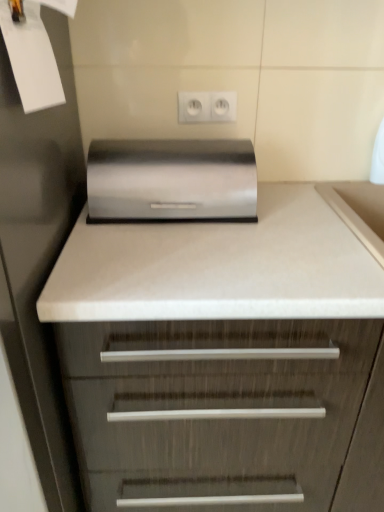
Question: Looking at their shapes, would you say white paper at upper left is wider or thinner than white plastic electric outlet at upper center?

Choices:
 (A) thin
 (B) wide

Answer: (B)

Question: Is white paper at upper left taller or shorter than white plastic electric outlet at upper center?

Choices:
 (A) tall
 (B) short

Answer: (A)

Question: Considering the real-world distances, which object is closest to the satin wood chest of drawers at center?

Choices:
 (A) white plastic electric outlet at upper center
 (B) white paper at upper left
 (C) satin metallic breadbox at center

Answer: (C)

Question: Which is farther from the white plastic electric outlet at upper center?

Choices:
 (A) satin wood chest of drawers at center
 (B) white paper at upper left
 (C) satin metallic breadbox at center

Answer: (A)